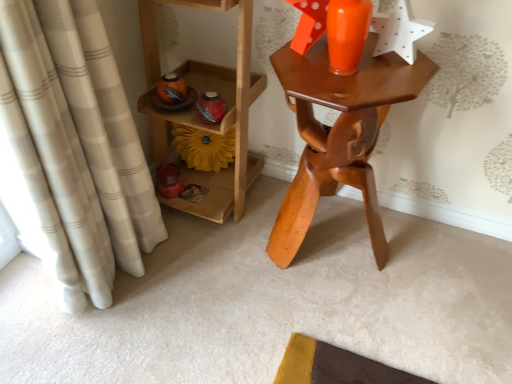
Question: Is wooden table at center shorter than beige plaid curtain at left?

Choices:
 (A) no
 (B) yes

Answer: (B)

Question: Is wooden table at center at the left side of beige plaid curtain at left?

Choices:
 (A) yes
 (B) no

Answer: (B)

Question: Considering the relative sizes of wooden table at center and beige plaid curtain at left in the image provided, is wooden table at center taller than beige plaid curtain at left?

Choices:
 (A) no
 (B) yes

Answer: (A)

Question: From the image's perspective, is wooden table at center beneath beige plaid curtain at left?

Choices:
 (A) no
 (B) yes

Answer: (A)

Question: Does wooden table at center touch beige plaid curtain at left?

Choices:
 (A) yes
 (B) no

Answer: (B)

Question: Considering the relative positions of yellow fabric flower at center and wooden table at center in the image provided, is yellow fabric flower at center to the left or to the right of wooden table at center?

Choices:
 (A) right
 (B) left

Answer: (B)

Question: From their relative heights in the image, would you say yellow fabric flower at center is taller or shorter than wooden table at center?

Choices:
 (A) tall
 (B) short

Answer: (B)

Question: Based on their sizes in the image, would you say yellow fabric flower at center is bigger or smaller than wooden table at center?

Choices:
 (A) big
 (B) small

Answer: (B)

Question: Which is correct: yellow fabric flower at center is inside wooden table at center, or outside of it?

Choices:
 (A) outside
 (B) inside

Answer: (A)

Question: Considering the positions of wooden shelf at left and beige plaid curtain at left in the image, is wooden shelf at left taller or shorter than beige plaid curtain at left?

Choices:
 (A) tall
 (B) short

Answer: (B)

Question: Do you think wooden shelf at left is within beige plaid curtain at left, or outside of it?

Choices:
 (A) inside
 (B) outside

Answer: (B)

Question: Considering their positions, is wooden shelf at left located in front of or behind beige plaid curtain at left?

Choices:
 (A) behind
 (B) front

Answer: (A)

Question: Visually, is wooden shelf at left positioned to the left or to the right of beige plaid curtain at left?

Choices:
 (A) left
 (B) right

Answer: (B)

Question: From the image's perspective, is beige plaid curtain at left positioned above or below wooden shelf at left?

Choices:
 (A) above
 (B) below

Answer: (B)

Question: Is point (9, 41) closer or farther from the camera than point (215, 208)?

Choices:
 (A) farther
 (B) closer

Answer: (B)